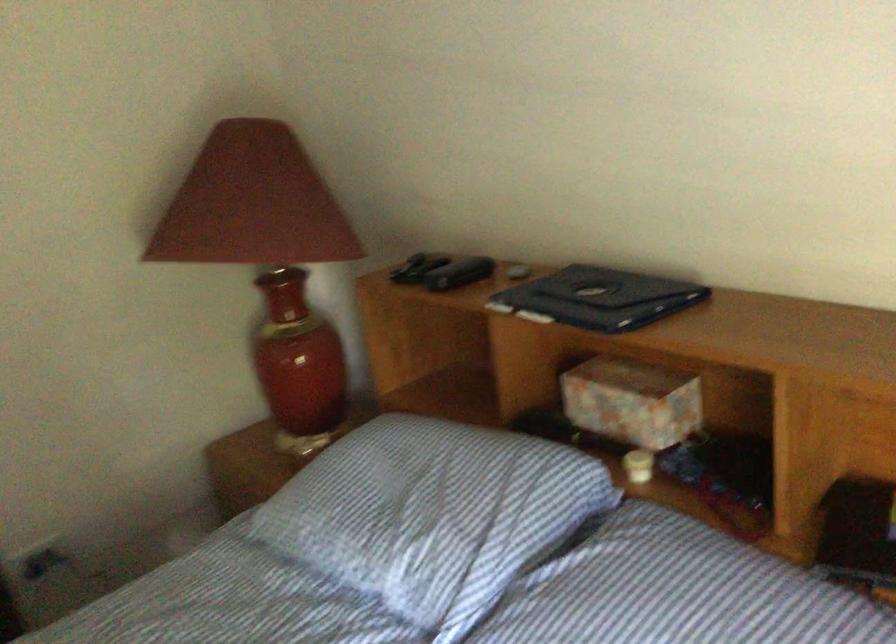
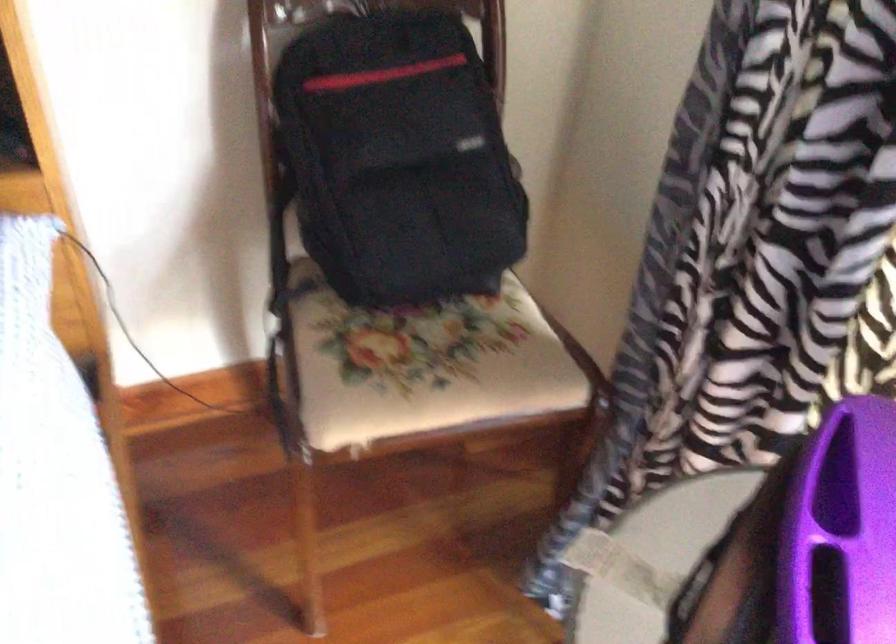
How did the camera likely rotate?

The camera's rotation is toward right-down.